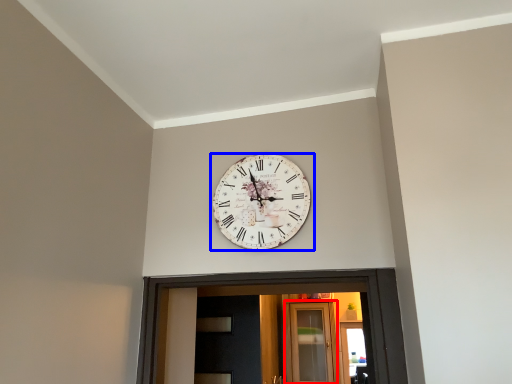
Question: Among these objects, which one is nearest to the camera, glass door (highlighted by a red box) or wall clock (highlighted by a blue box)?

Choices:
 (A) glass door
 (B) wall clock

Answer: (B)